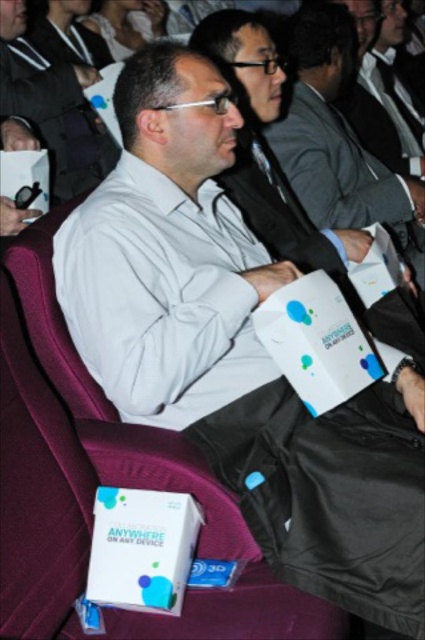
You are standing in the auditorium and want to walk towards the point that is closer to you. Which point should you head towards, point (362, 196) or point (31, 28)?

You should head towards point (362, 196) because it is closer to the viewer than point (31, 28).

You are sitting in the auditorium and need to locate two specific points marked in the scene. Which of the two points, point 1 at coordinates point (85,132) or point 2 at coordinates point (45,44), is closer to you from your seated position?

Point 1 at coordinates point (85,132) is closer to you because it is in front of point 2 at coordinates point (45,44).

You are an event organizer trying to arrange seating for a photo shoot. You need to place a 20 cm wide prop between the dark gray suit at center and the matte white box at center. Based on their sizes, will there be enough space between them to fit the prop?

The dark gray suit at center is wider than the matte white box at center. Since the prop is 20 cm wide, and the space between them depends on their widths, it is likely there is sufficient space to place the prop between them.